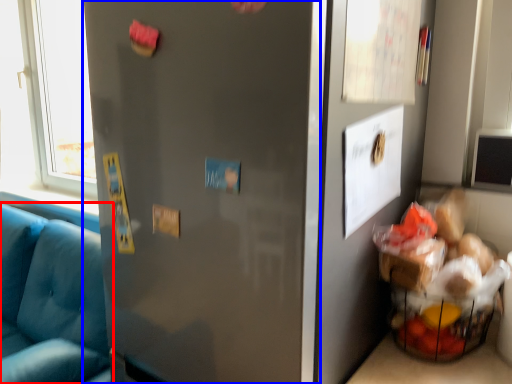
Question: Which object appears closest to the camera in this image, studio couch (highlighted by a red box) or door (highlighted by a blue box)?

Choices:
 (A) studio couch
 (B) door

Answer: (B)